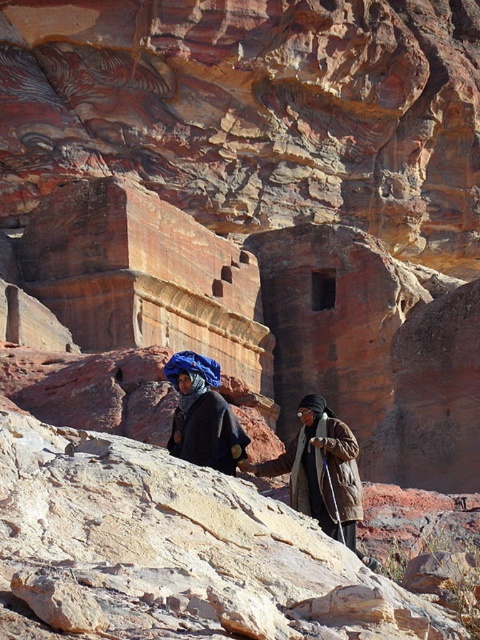
Is brown textured coat at center thinner than dark blue woolen robe at center?

No.

Is point (342, 465) in front of point (220, 460)?

No, it is not.

I want to click on brown textured coat at center, so click(x=322, y=472).

Where is `smooth beige rock at center`? smooth beige rock at center is located at coordinates (177, 548).

Is smooth beige rock at center further to the viewer compared to brown textured coat at center?

No, it is in front of brown textured coat at center.

Find the location of `smooth beige rock at center`. smooth beige rock at center is located at coordinates (177, 548).

Does smooth beige rock at center have a smaller size compared to dark blue woolen robe at center?

No.

Is smooth beige rock at center positioned behind dark blue woolen robe at center?

No, smooth beige rock at center is closer to the viewer.

Which is in front, point (116, 451) or point (223, 420)?

Point (116, 451) is more forward.

The image size is (480, 640). I want to click on smooth beige rock at center, so click(177, 548).